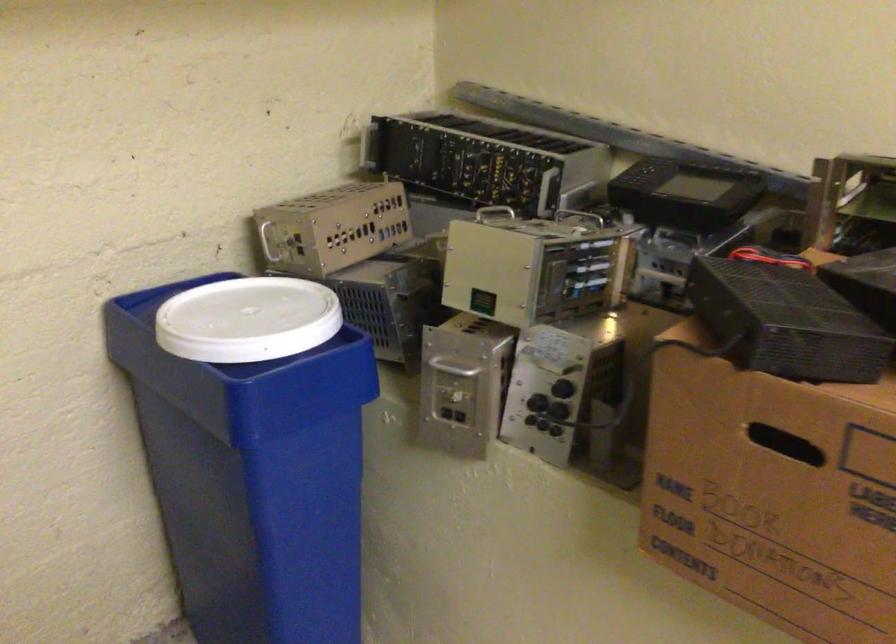
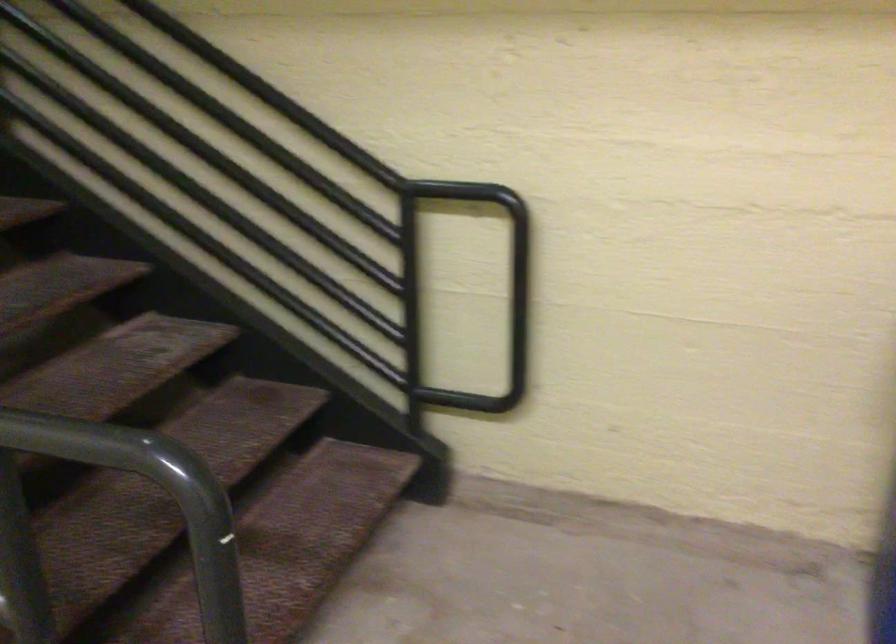
Question: How did the camera likely rotate?

Choices:
 (A) Left
 (B) Right
 (C) Up
 (D) Down

Answer: (A)